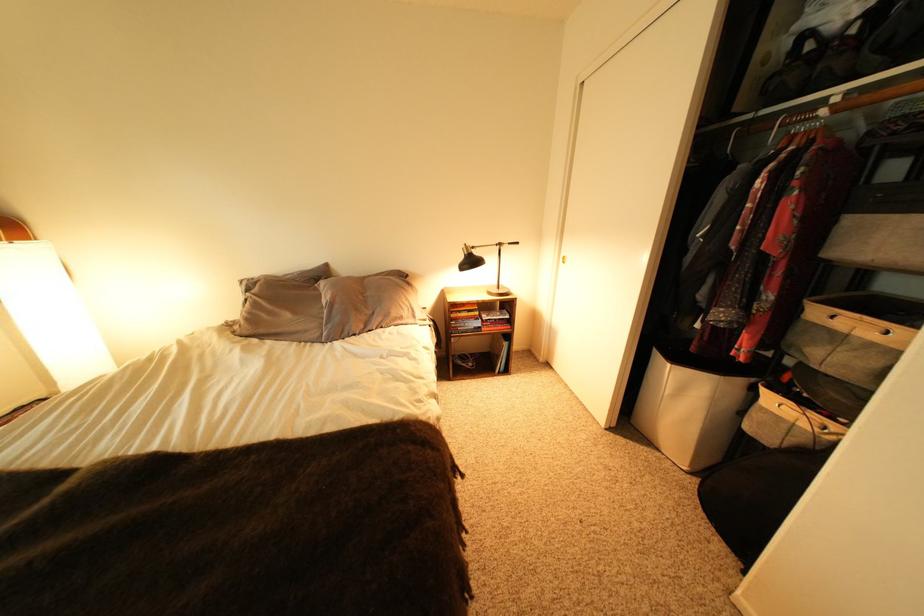
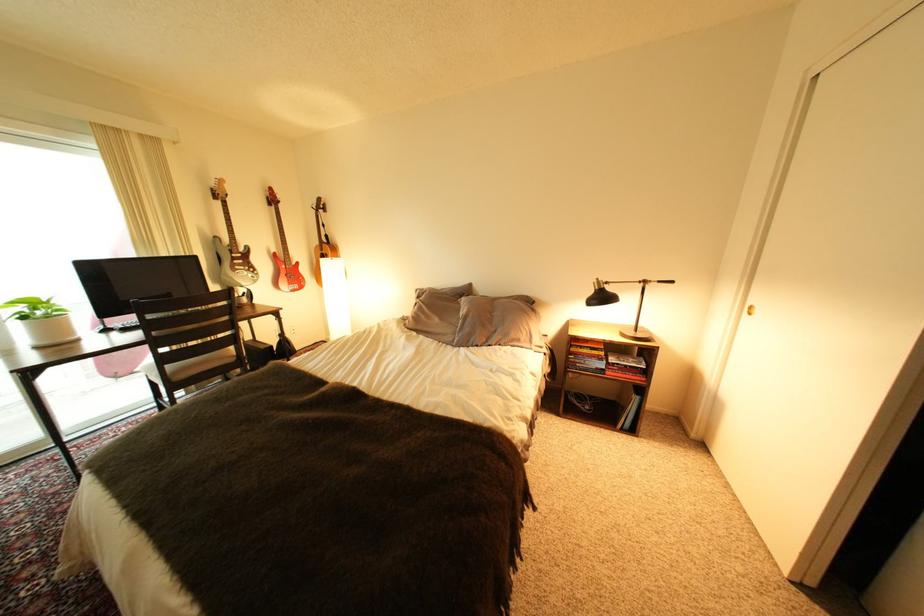
In the second image, find the point that corresponds to point 479,268 in the first image.

(608, 304)